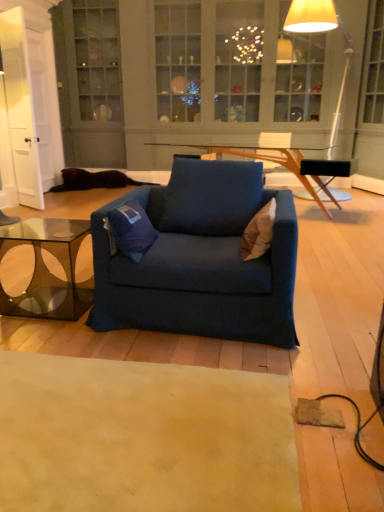
Question: Looking at their shapes, would you say blue fabric armchair at center is wider or thinner than transparent glass coffee table at lower left?

Choices:
 (A) wide
 (B) thin

Answer: (A)

Question: From the image's perspective, relative to transparent glass coffee table at lower left, is blue fabric armchair at center above or below?

Choices:
 (A) below
 (B) above

Answer: (B)

Question: Considering the real-world distances, which object is closest to the blue fabric chair at center?

Choices:
 (A) transparent glass coffee table at lower left
 (B) beige fabric pillow at center, marked as the 1th pillow in a right-to-left arrangement
 (C) beige carpet at lower center
 (D) blue fabric pillow at center, the first pillow from the left
 (E) matte white floor lamp at upper right

Answer: (E)

Question: Which is nearer to the transparent glass coffee table at lower left?

Choices:
 (A) beige carpet at lower center
 (B) blue fabric chair at center
 (C) blue fabric armchair at center
 (D) blue fabric pillow at center, the first pillow from the left
 (E) matte white floor lamp at upper right

Answer: (B)